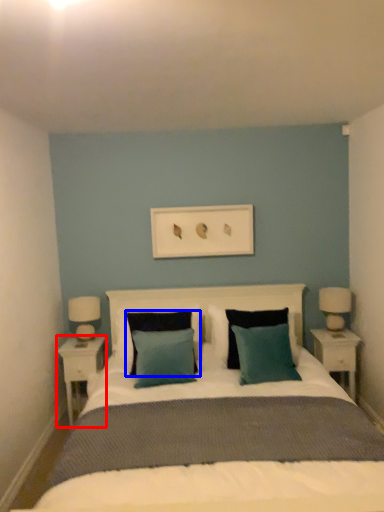
Question: Which point is further to the camera, nightstand (highlighted by a red box) or pillow (highlighted by a blue box)?

Choices:
 (A) nightstand
 (B) pillow

Answer: (A)